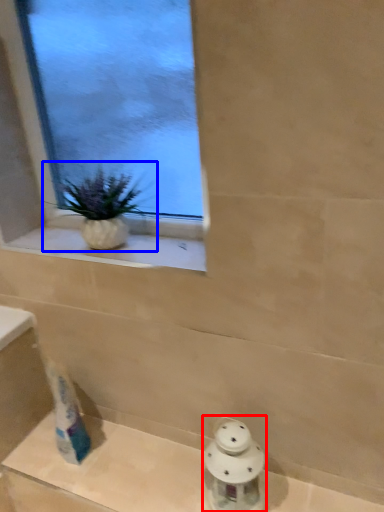
Question: Which of the following is the farthest to the observer, porcelain (highlighted by a red box) or houseplant (highlighted by a blue box)?

Choices:
 (A) porcelain
 (B) houseplant

Answer: (B)